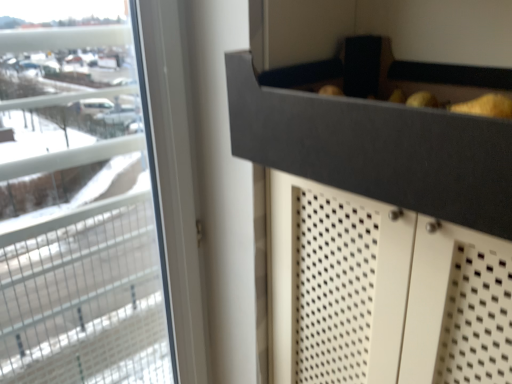
Find the location of `black matte drawer at upper center`. black matte drawer at upper center is located at coordinates (380, 131).

This screenshot has width=512, height=384. Describe the element at coordinates (380, 131) in the screenshot. I see `black matte drawer at upper center` at that location.

What do you see at coordinates (94, 265) in the screenshot? This screenshot has width=512, height=384. I see `transparent glass window at left` at bounding box center [94, 265].

Locate an element on the screen. This screenshot has width=512, height=384. transparent glass window at left is located at coordinates (94, 265).

The height and width of the screenshot is (384, 512). Identify the location of black matte drawer at upper center. (380, 131).

Can you confirm if black matte drawer at upper center is positioned to the left of transparent glass window at left?

In fact, black matte drawer at upper center is to the right of transparent glass window at left.

Who is more distant, black matte drawer at upper center or transparent glass window at left?

transparent glass window at left is further from the camera.

Does point (357, 84) come closer to viewer compared to point (74, 243)?

Yes, point (357, 84) is in front of point (74, 243).

From the image's perspective, which is above, black matte drawer at upper center or transparent glass window at left?

black matte drawer at upper center, from the image's perspective.

From a real-world perspective, who is located higher, black matte drawer at upper center or transparent glass window at left?

black matte drawer at upper center.

Which object is wider, black matte drawer at upper center or transparent glass window at left?

Wider between the two is black matte drawer at upper center.

Is black matte drawer at upper center taller than transparent glass window at left?

No.

Does black matte drawer at upper center have a smaller size compared to transparent glass window at left?

Indeed, black matte drawer at upper center has a smaller size compared to transparent glass window at left.

Is black matte drawer at upper center located outside transparent glass window at left?

black matte drawer at upper center lies outside transparent glass window at left's area.

Is there a large distance between black matte drawer at upper center and transparent glass window at left?

They are positioned close to each other.

Is black matte drawer at upper center oriented away from transparent glass window at left?

No, black matte drawer at upper center is not facing away from transparent glass window at left.

Find the location of `drawer above the transparent glass window at left (from a real-world perspective)`. drawer above the transparent glass window at left (from a real-world perspective) is located at coordinates (380, 131).

Considering the relative positions of transparent glass window at left and black matte drawer at upper center in the image provided, is transparent glass window at left to the right of black matte drawer at upper center from the viewer's perspective?

In fact, transparent glass window at left is to the left of black matte drawer at upper center.

Relative to black matte drawer at upper center, is transparent glass window at left in front or behind?

In the image, transparent glass window at left appears behind black matte drawer at upper center.

Does point (19, 239) appear closer or farther from the camera than point (506, 165)?

Point (19, 239) appears to be farther away from the viewer than point (506, 165).

From the image's perspective, which is below, transparent glass window at left or black matte drawer at upper center?

transparent glass window at left appears lower in the image.

From a real-world perspective, which is physically above, transparent glass window at left or black matte drawer at upper center?

black matte drawer at upper center is physically above.

Does transparent glass window at left have a greater width compared to black matte drawer at upper center?

In fact, transparent glass window at left might be narrower than black matte drawer at upper center.

Which of these two, transparent glass window at left or black matte drawer at upper center, stands shorter?

With less height is black matte drawer at upper center.

Considering the sizes of transparent glass window at left and black matte drawer at upper center in the image, is transparent glass window at left bigger or smaller than black matte drawer at upper center?

Clearly, transparent glass window at left is larger in size than black matte drawer at upper center.

Is transparent glass window at left positioned beyond the bounds of black matte drawer at upper center?

Yes, transparent glass window at left is not within black matte drawer at upper center.

Is transparent glass window at left placed right next to black matte drawer at upper center?

transparent glass window at left and black matte drawer at upper center are clearly separated.

Is transparent glass window at left facing away from black matte drawer at upper center?

No.

Can you tell me how much transparent glass window at left and black matte drawer at upper center differ in facing direction?

89.7 degrees separate the facing orientations of transparent glass window at left and black matte drawer at upper center.

Image resolution: width=512 pixels, height=384 pixels. I want to click on window below the black matte drawer at upper center (from the image's perspective), so pyautogui.click(x=94, y=265).

Locate an element on the screen. drawer above the transparent glass window at left (from the image's perspective) is located at coordinates (380, 131).

Image resolution: width=512 pixels, height=384 pixels. In order to click on drawer that is on the right side of transparent glass window at left in this screenshot , I will do `click(380, 131)`.